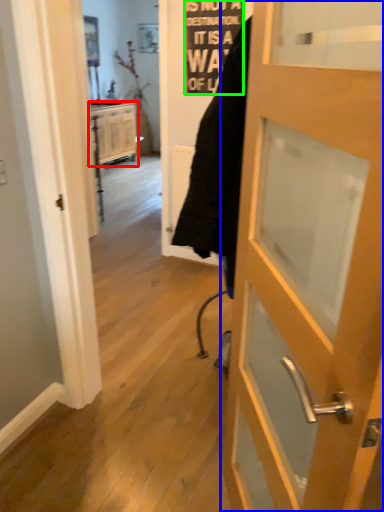
Question: Which is farther away from cabinetry (highlighted by a red box)? door (highlighted by a blue box) or writing (highlighted by a green box)?

Choices:
 (A) door
 (B) writing

Answer: (A)